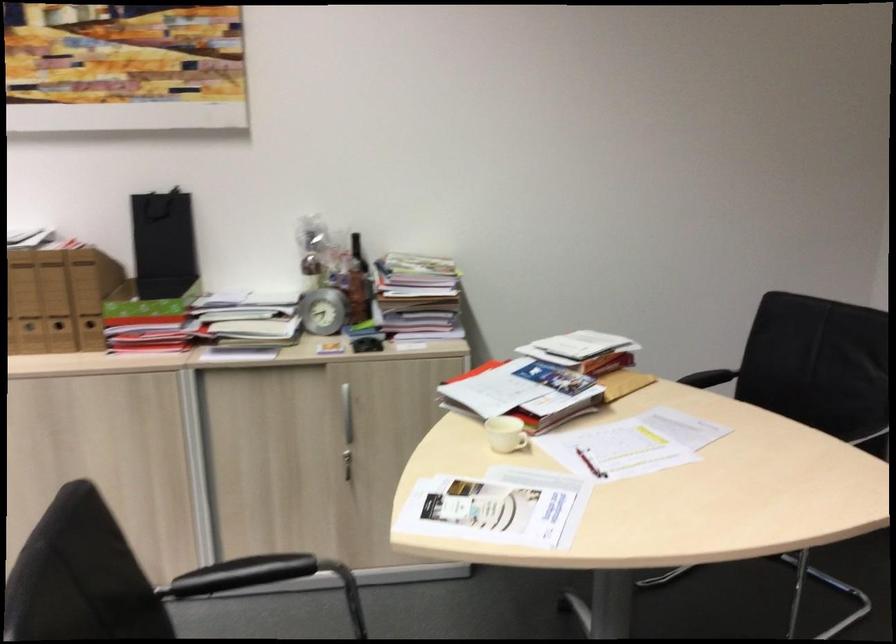
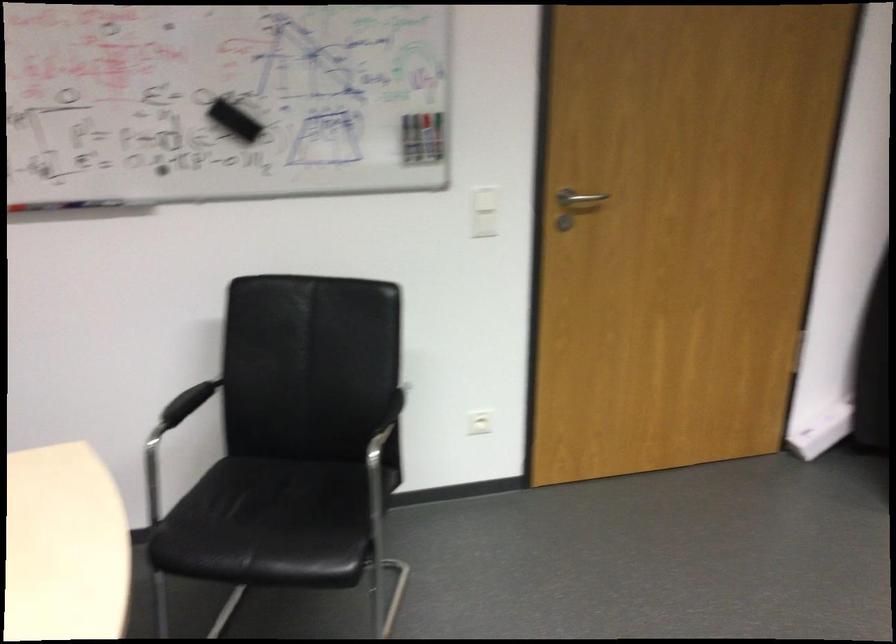
The images are taken continuously from a first-person perspective. In which direction is your viewpoint rotating?

The rotation direction of the camera is right-down.